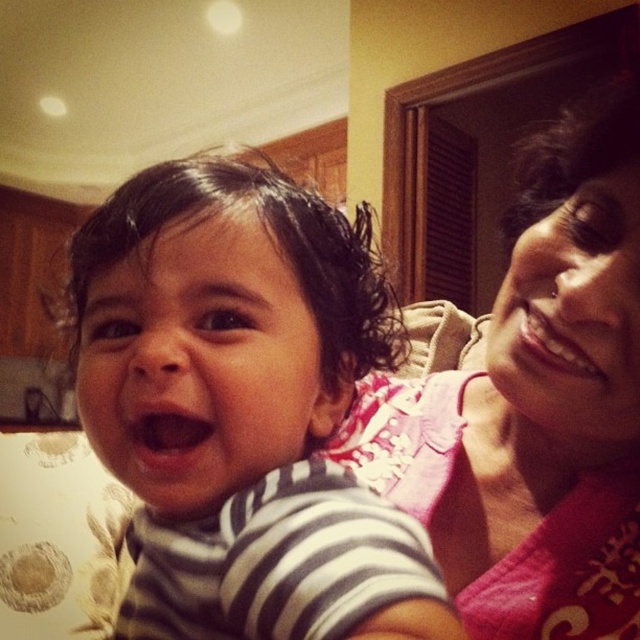
You are holding a camera and want to take a photo of the scene. The camera is currently at a point labeled as point (605, 460). If you want to ensure that the entire scene is captured clearly, should you move closer or farther away from the scene?

The point (605, 460) is 54.15 centimeters away from the camera. To ensure the entire scene is captured clearly, you should move farther away from the scene so that more of it can be included in the frame.

You are taking a photo of two points in the image. The first point is at coordinates point (157,396) and the second point is at point (547,337). Which point will appear larger in your photo?

Point (157,396) is closer to the camera than point (547,337), so it will appear larger in the photo.